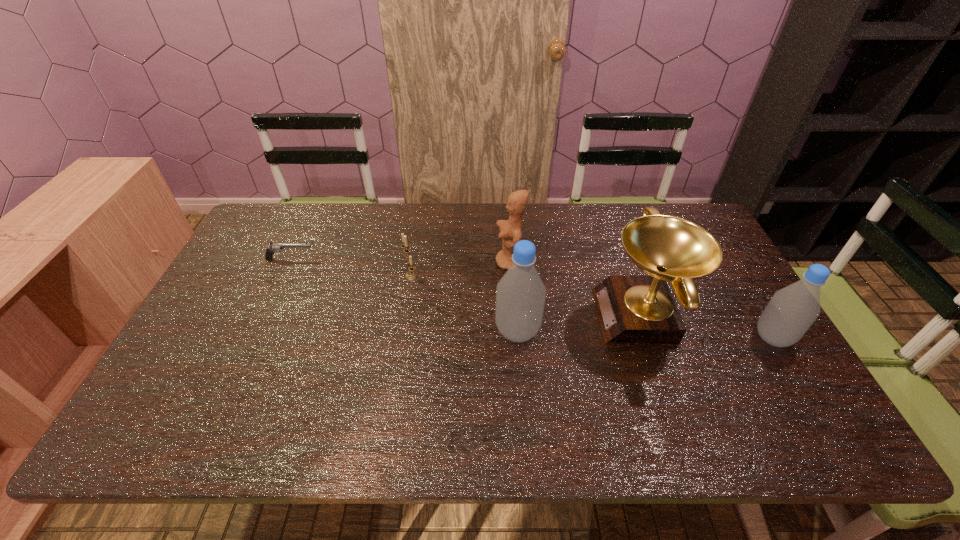
Identify the location of free space in the image that satisfies the following two spatial constraints: 1. on the back side of the rightmost object; 2. on the front-facing side of the fifth object from left to right. (760, 316).

Where is `free space that satisfies the following two spatial constraints: 1. on the front-facing side of the leftmost object; 2. on the back side of the shorter bottle`? The image size is (960, 540). free space that satisfies the following two spatial constraints: 1. on the front-facing side of the leftmost object; 2. on the back side of the shorter bottle is located at coordinates (253, 338).

Where is `free space that satisfies the following two spatial constraints: 1. on the front-facing side of the figurine; 2. on the right side of the right bottle`? free space that satisfies the following two spatial constraints: 1. on the front-facing side of the figurine; 2. on the right side of the right bottle is located at coordinates (516, 338).